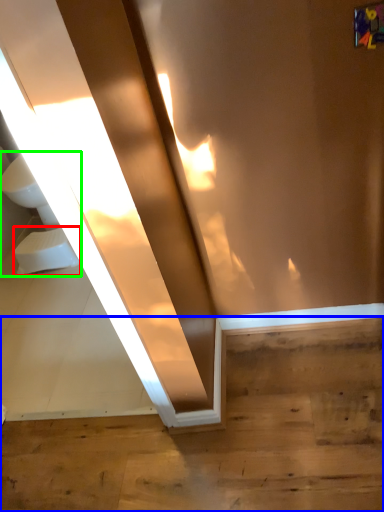
Question: Which object is the closest to the toilet bowl (highlighted by a red box)? Choose among these: stairwell (highlighted by a blue box) or sink (highlighted by a green box).

Choices:
 (A) stairwell
 (B) sink

Answer: (B)